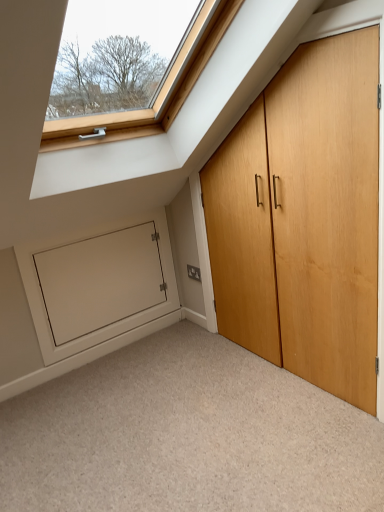
What is the approximate height of white matte door at lower left?

The height of white matte door at lower left is 28.87 inches.

Locate an element on the screen. This screenshot has width=384, height=512. white matte door at lower left is located at coordinates (100, 280).

Where is `white matte door at lower left`? white matte door at lower left is located at coordinates (100, 280).

From a real-world perspective, is carpeted floor at lower center above or below light brown wood door at right?

carpeted floor at lower center is below light brown wood door at right.

You are a GUI agent. You are given a task and a screenshot of the screen. Output one action in this format:
    pyautogui.click(x=<x>, y=<y>)
    Task: Click on the door behind the carpeted floor at lower center
    The height and width of the screenshot is (512, 384).
    Given the screenshot: What is the action you would take?
    pyautogui.click(x=304, y=219)

Is carpeted floor at lower center oriented away from light brown wood door at right?

That's right, carpeted floor at lower center is facing away from light brown wood door at right.

Is carpeted floor at lower center placed right next to light brown wood door at right?

There is a gap between carpeted floor at lower center and light brown wood door at right.

Can you confirm if white matte door at lower left is thinner than carpeted floor at lower center?

Correct, the width of white matte door at lower left is less than that of carpeted floor at lower center.

Is white matte door at lower left next to carpeted floor at lower center and touching it?

No.

From the image's perspective, would you say white matte door at lower left is shown under light brown wood door at right?

Correct, white matte door at lower left appears lower than light brown wood door at right in the image.

Which is less distant, (57, 339) or (268, 139)?

Point (268, 139)

Considering the sizes of objects white matte door at lower left and light brown wood door at right in the image provided, who is shorter, white matte door at lower left or light brown wood door at right?

white matte door at lower left.

Is there a large distance between light brown wood door at right and carpeted floor at lower center?

No, light brown wood door at right is in close proximity to carpeted floor at lower center.

How different are the orientations of light brown wood door at right and carpeted floor at lower center in degrees?

The angular difference between light brown wood door at right and carpeted floor at lower center is 0.641 degrees.

Considering the positions of objects light brown wood door at right and carpeted floor at lower center in the image provided, who is more to the left, light brown wood door at right or carpeted floor at lower center?

carpeted floor at lower center is more to the left.

Does light brown wood door at right have a lesser height compared to carpeted floor at lower center?

No.

Relative to white matte door at lower left, is light brown wood door at right in front or behind?

light brown wood door at right is in front of white matte door at lower left.

What's the angular difference between light brown wood door at right and white matte door at lower left's facing directions?

light brown wood door at right and white matte door at lower left are facing 90 degrees away from each other.

Considering the positions of objects light brown wood door at right and white matte door at lower left in the image provided, who is more to the right, light brown wood door at right or white matte door at lower left?

Positioned to the right is light brown wood door at right.

Is light brown wood door at right next to white matte door at lower left?

light brown wood door at right and white matte door at lower left are clearly separated.

At what (x,y) coordinates should I click in order to perform the action: click on screen door to the left of carpeted floor at lower center. Please return your answer as a coordinate pair (x, y). Image resolution: width=384 pixels, height=512 pixels. Looking at the image, I should click on (100, 280).

Between point (263, 420) and point (146, 298), which one is positioned behind?

Point (146, 298)

Who is taller, carpeted floor at lower center or white matte door at lower left?

With more height is white matte door at lower left.

Locate an element on the screen. door that appears above the carpeted floor at lower center (from the image's perspective) is located at coordinates (304, 219).

Where is `screen door above the carpeted floor at lower center (from a real-world perspective)`? This screenshot has height=512, width=384. screen door above the carpeted floor at lower center (from a real-world perspective) is located at coordinates (100, 280).

Which object lies further to the anchor point white matte door at lower left, carpeted floor at lower center or light brown wood door at right?

Based on the image, light brown wood door at right appears to be further to white matte door at lower left.

When comparing their distances from light brown wood door at right, does carpeted floor at lower center or white matte door at lower left seem further?

white matte door at lower left.

Estimate the real-world distances between objects in this image. Which object is closer to light brown wood door at right, white matte door at lower left or carpeted floor at lower center?

carpeted floor at lower center is positioned closer to the anchor light brown wood door at right.

From the image, which object appears to be farther from white matte door at lower left, light brown wood door at right or carpeted floor at lower center?

light brown wood door at right is positioned further to the anchor white matte door at lower left.

Estimate the real-world distances between objects in this image. Which object is further from carpeted floor at lower center, white matte door at lower left or light brown wood door at right?

Based on the image, white matte door at lower left appears to be further to carpeted floor at lower center.

Considering their positions, is light brown wood door at right positioned closer to carpeted floor at lower center than white matte door at lower left?

light brown wood door at right lies closer to carpeted floor at lower center than the other object.

The width and height of the screenshot is (384, 512). I want to click on door positioned between carpeted floor at lower center and white matte door at lower left from near to far, so click(x=304, y=219).